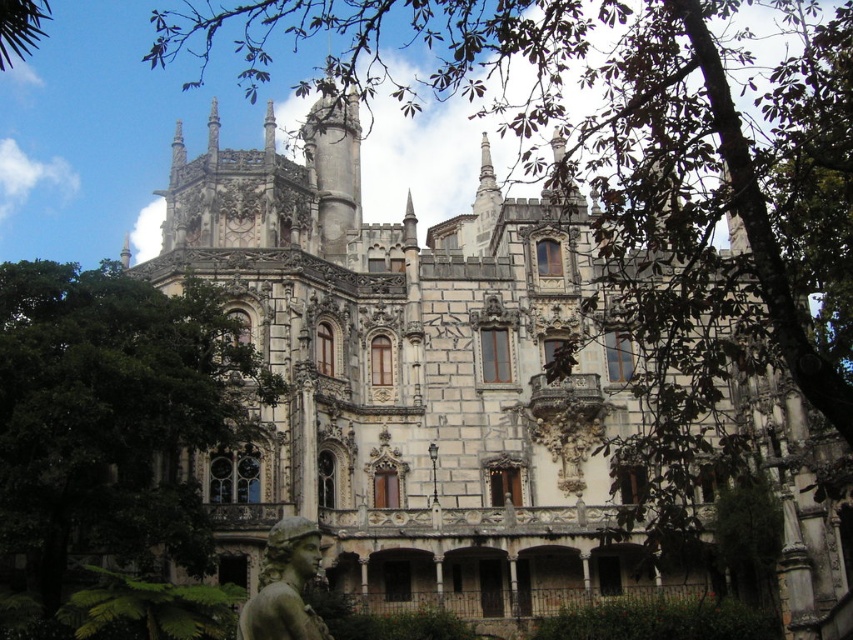
Can you confirm if green leafy tree at center is taller than green marble statue at lower center?

Indeed, green leafy tree at center has a greater height compared to green marble statue at lower center.

Find the location of a particular element. green leafy tree at center is located at coordinates (113, 416).

Describe the element at coordinates (113, 416) in the screenshot. I see `green leafy tree at center` at that location.

Where is `green leafy tree at center`? The height and width of the screenshot is (640, 853). green leafy tree at center is located at coordinates (113, 416).